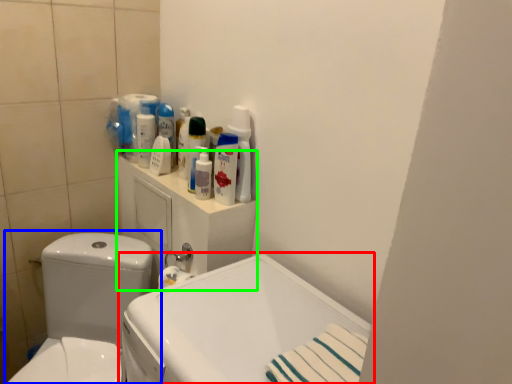
Question: Estimate the real-world distances between objects in this image. Which object is farther from sink (highlighted by a red box), toilet (highlighted by a blue box) or medicine cabinet (highlighted by a green box)?

Choices:
 (A) toilet
 (B) medicine cabinet

Answer: (A)